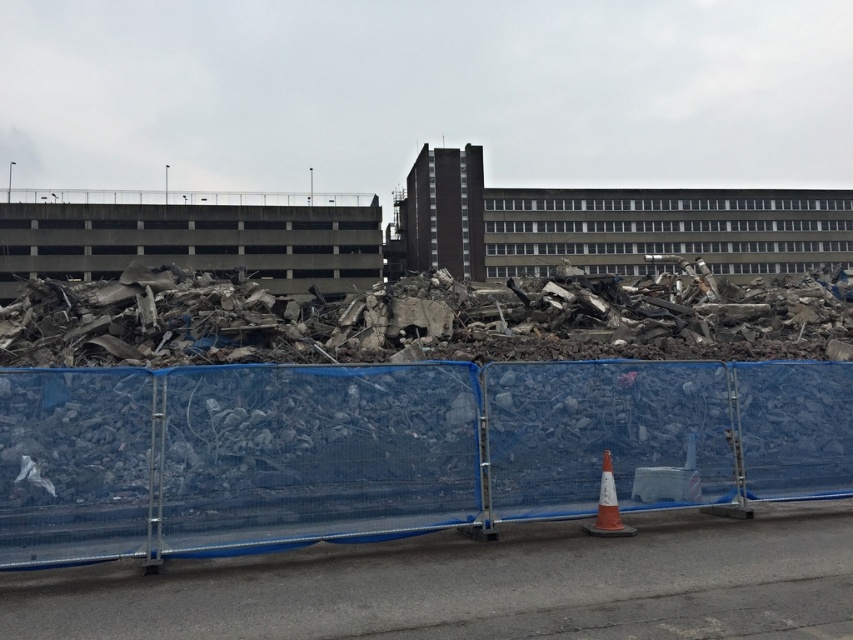
You are a drone operator tasked with capturing aerial footage of the construction site. You need to fly your drone from the blue temporary fence to the large pile of rubble. Your drone has a limited flight path and can only move in a straight line. Based on the coordinates provided, which point, point (746, 477) or point (601, 481), is closer to the camera and should be your starting point for the flight path?

Point (601, 481) is closer to the camera than point (746, 477). Therefore, you should start your flight path from point (601, 481) to ensure the drone captures the rubble pile effectively.

You are a surveyor trying to map the construction site. According to the image, where is the blue mesh fence at center located in terms of coordinates?

The blue mesh fence at center is located at coordinates point (393, 449).

You are a safety inspector checking the construction site. You notice the blue mesh fence at center and the orange reflective cone at lower center. According to safety regulations, the fence must be at least twice the height of the cone. Does the current setup comply with the regulation?

The blue mesh fence at center has a smaller size compared to orange reflective cone at lower center, so it is not twice the height of the cone. Therefore, the current setup does not comply with the safety regulation.